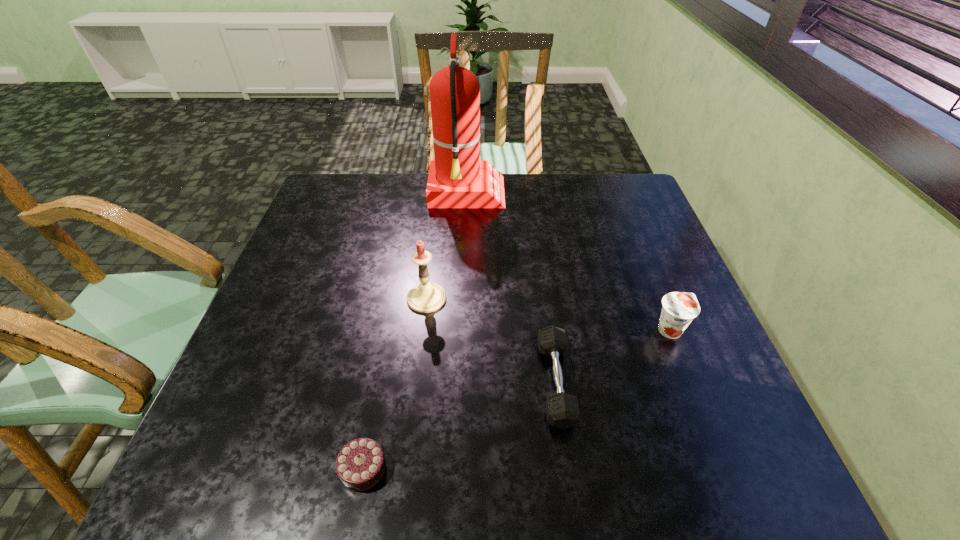
This screenshot has height=540, width=960. I want to click on the tallest object, so click(457, 178).

Find the location of `fire extinguisher`. fire extinguisher is located at coordinates (457, 178).

Image resolution: width=960 pixels, height=540 pixels. I want to click on the fourth nearest object, so click(x=426, y=297).

The height and width of the screenshot is (540, 960). Find the location of `the fourth shortest object`. the fourth shortest object is located at coordinates (426, 297).

I want to click on yogurt, so click(x=679, y=308).

Where is `the rightmost object`? Image resolution: width=960 pixels, height=540 pixels. the rightmost object is located at coordinates (679, 308).

You are a GUI agent. You are given a task and a screenshot of the screen. Output one action in this format:
    pyautogui.click(x=<x>, y=<y>)
    Task: Click on the fourth object from left to right
    The image size is (960, 540).
    Given the screenshot: What is the action you would take?
    click(562, 410)

Identify the location of the nearest object. This screenshot has height=540, width=960. (360, 465).

Locate an element on the screen. The image size is (960, 540). the shortest object is located at coordinates (360, 465).

Image resolution: width=960 pixels, height=540 pixels. I want to click on free space located on the front-facing side of the tallest object, so [631, 194].